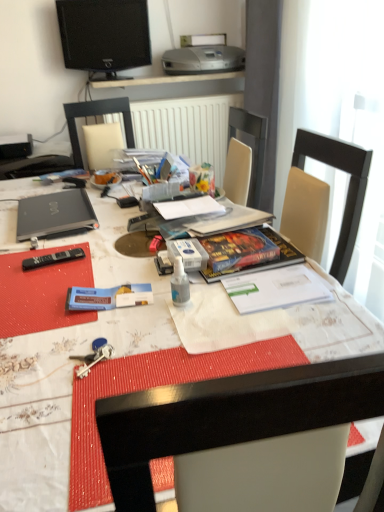
The width and height of the screenshot is (384, 512). Find the location of `vacant space situated on the left part of black plastic remote control at lower left`. vacant space situated on the left part of black plastic remote control at lower left is located at coordinates (13, 258).